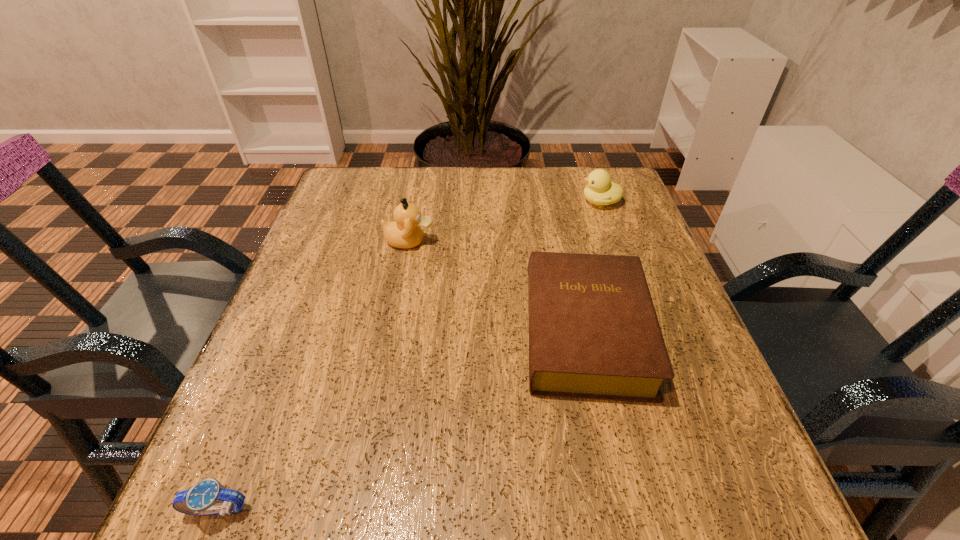
The image size is (960, 540). In order to click on the taller duckling in this screenshot , I will do point(405,232).

Locate an element on the screen. The width and height of the screenshot is (960, 540). the left duckling is located at coordinates (405, 232).

You are a GUI agent. You are given a task and a screenshot of the screen. Output one action in this format:
    pyautogui.click(x=<x>, y=<y>)
    Task: Click on the right duckling
    Image resolution: width=960 pixels, height=540 pixels.
    Given the screenshot: What is the action you would take?
    pyautogui.click(x=600, y=191)

Where is `the farthest object`? the farthest object is located at coordinates (600, 191).

Where is `Bible`? This screenshot has height=540, width=960. Bible is located at coordinates (593, 330).

The width and height of the screenshot is (960, 540). Identify the location of the second nearest object. (593, 330).

Locate an element on the screen. the shortest object is located at coordinates (202, 499).

The image size is (960, 540). I want to click on the leftmost object, so click(x=202, y=499).

At what (x,y) coordinates should I click in order to perform the action: click on free space located on the face of the left duckling. Please return your answer as a coordinate pair (x, y). The width and height of the screenshot is (960, 540). Looking at the image, I should click on (523, 241).

Identify the location of vacant space located 0.270m at the beak of the farther duckling. (472, 202).